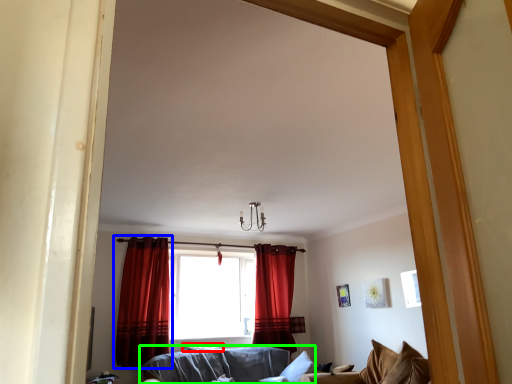
Question: Which is nearer to the pillow (highlighted by a red box)? curtain (highlighted by a blue box) or studio couch (highlighted by a green box).

Choices:
 (A) curtain
 (B) studio couch

Answer: (B)